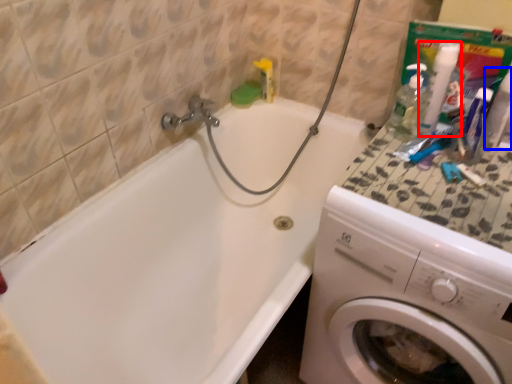
Question: Which object is further to the camera taking this photo, cleaning product (highlighted by a red box) or bottle (highlighted by a blue box)?

Choices:
 (A) cleaning product
 (B) bottle

Answer: (A)